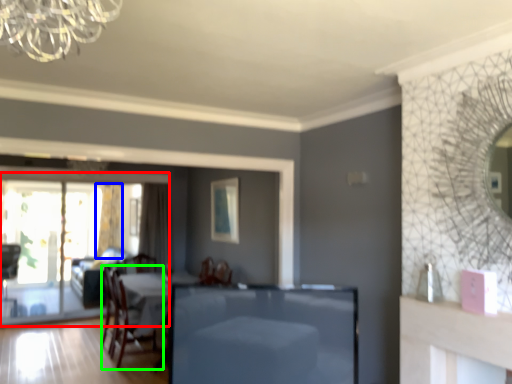
Question: Based on their relative distances, which object is nearer to screen door (highlighted by a red box)? Choose from curtain (highlighted by a blue box) and chair (highlighted by a green box).

Choices:
 (A) curtain
 (B) chair

Answer: (A)